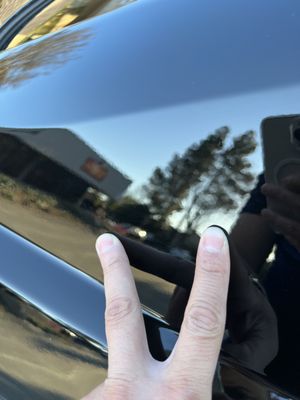
Image resolution: width=300 pixels, height=400 pixels. Identify the location of phone. (278, 145).